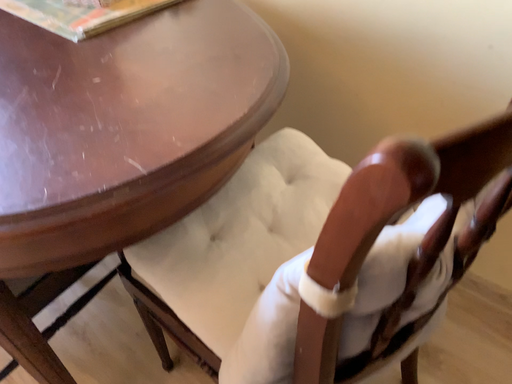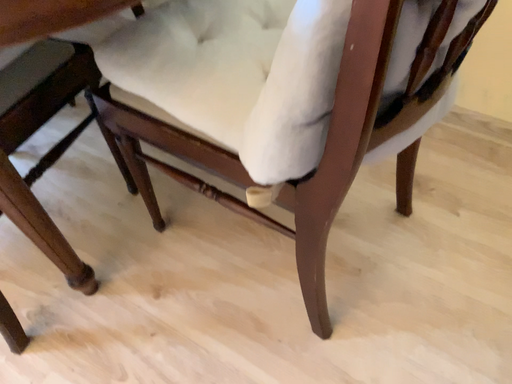
Question: How did the camera likely rotate when shooting the video?

Choices:
 (A) rotated right
 (B) rotated left

Answer: (A)